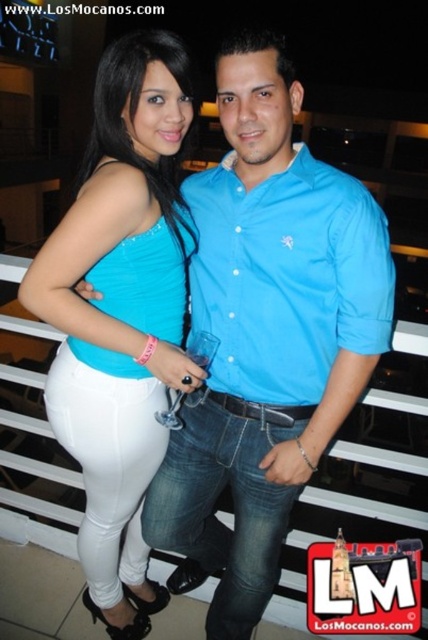
Question: Which is farther from the matte blue button-up shirt at center?

Choices:
 (A) matte blue tank top at center
 (B) matte blue shirt at center

Answer: (A)

Question: Can you confirm if matte blue shirt at center is positioned below matte blue button-up shirt at center?

Choices:
 (A) no
 (B) yes

Answer: (B)

Question: Can you confirm if matte blue shirt at center is positioned to the right of matte blue tank top at center?

Choices:
 (A) no
 (B) yes

Answer: (B)

Question: Which of the following is the closest to the observer?

Choices:
 (A) (287, 177)
 (B) (181, 120)
 (C) (282, 196)

Answer: (C)

Question: Which of these objects is positioned farthest from the matte blue button-up shirt at center?

Choices:
 (A) matte blue tank top at center
 (B) matte blue shirt at center

Answer: (A)

Question: Is matte blue tank top at center bigger than matte blue button-up shirt at center?

Choices:
 (A) yes
 (B) no

Answer: (A)